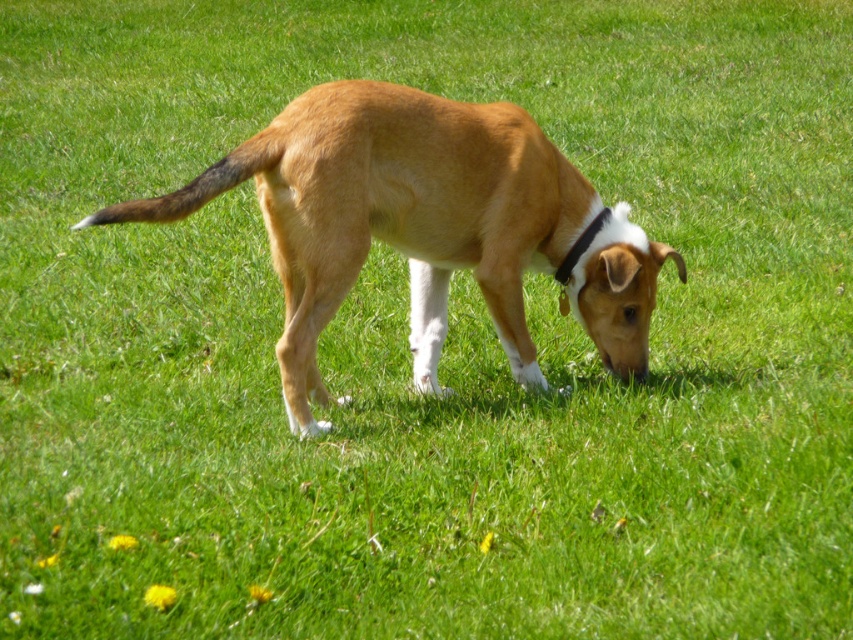
Question: Does golden fur dog at center have a lesser width compared to black fabric neckband at center?

Choices:
 (A) yes
 (B) no

Answer: (B)

Question: Which of the following is the farthest from the observer?

Choices:
 (A) golden fur dog at center
 (B) black fabric neckband at center

Answer: (B)

Question: From the image, what is the correct spatial relationship of golden fur dog at center in relation to black fabric neckband at center?

Choices:
 (A) above
 (B) below

Answer: (B)

Question: Does golden fur dog at center appear over black fabric neckband at center?

Choices:
 (A) no
 (B) yes

Answer: (A)